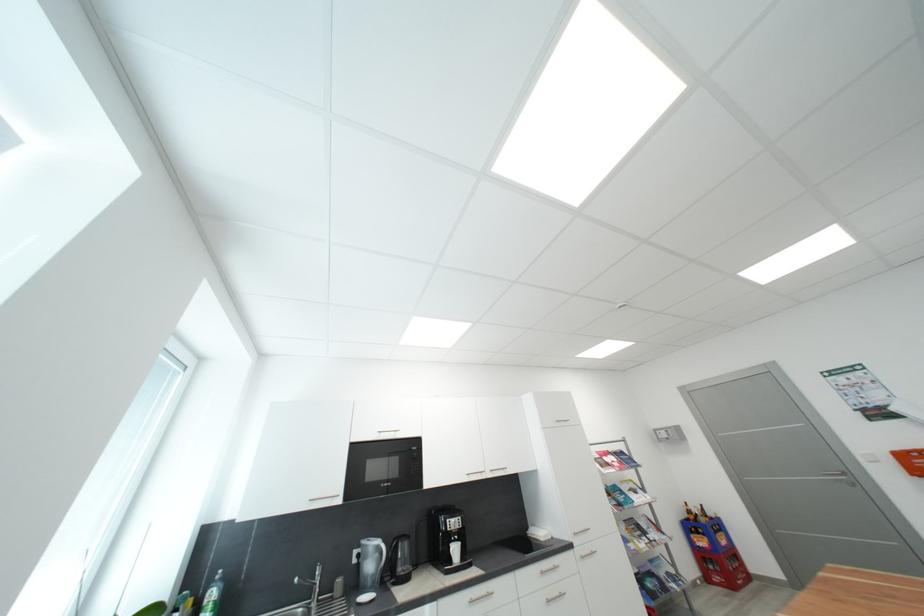
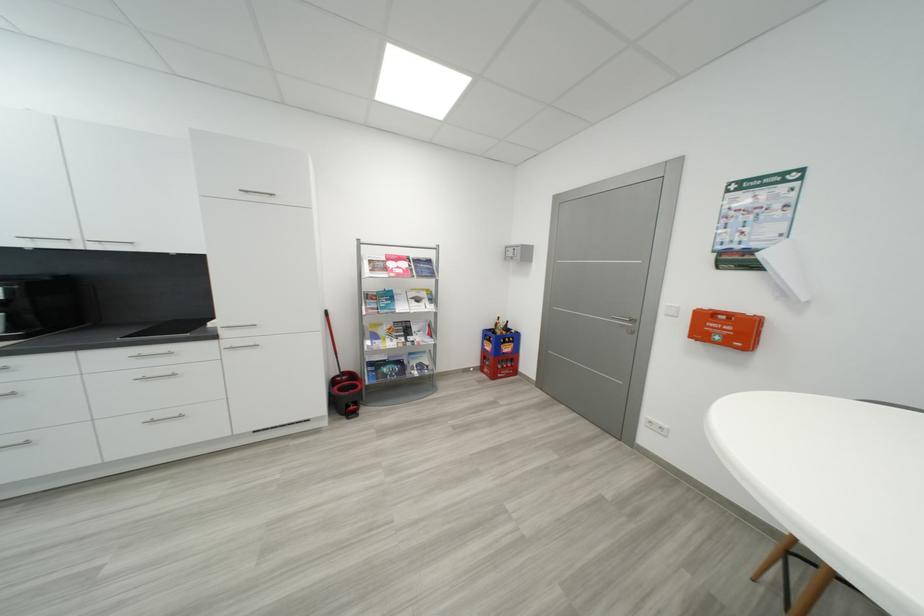
The point at (650, 527) is marked in the first image. Where is the corresponding point in the second image?

(421, 330)